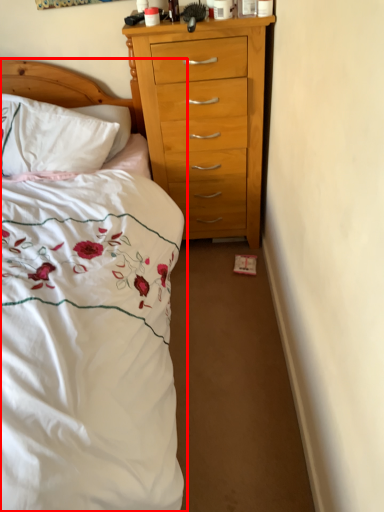
Question: From the image's perspective, where is bed (annotated by the red box) located in relation to pillow in the image?

Choices:
 (A) below
 (B) above

Answer: (A)